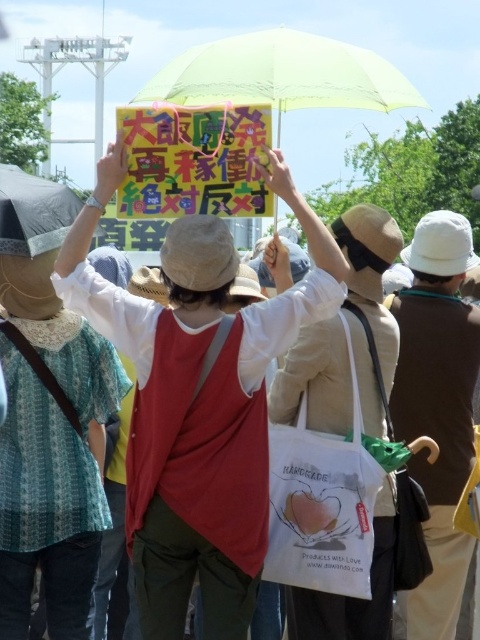
You are a photographer trying to capture the person holding the handmade products bag in the scene. Since the transparent yellow umbrella at upper center is blocking your view, can you move around to the left side to get a clear shot of the matte white shirt at center?

The matte white shirt at center is in front of the transparent yellow umbrella at upper center, so moving to the left side might not be necessary as the shirt is already blocking the umbrella. However, if you want to focus on the shirt without the umbrella in the background, moving to the side could help frame the shot better.

In the scene shown: You are a photographer trying to capture the yellow paper sign at upper center without including the matte black umbrella at upper left in the frame. Based on their positions, is this possible?

The yellow paper sign at upper center is positioned over the matte black umbrella at upper left, so it would be challenging to capture the sign without including the umbrella in the frame.